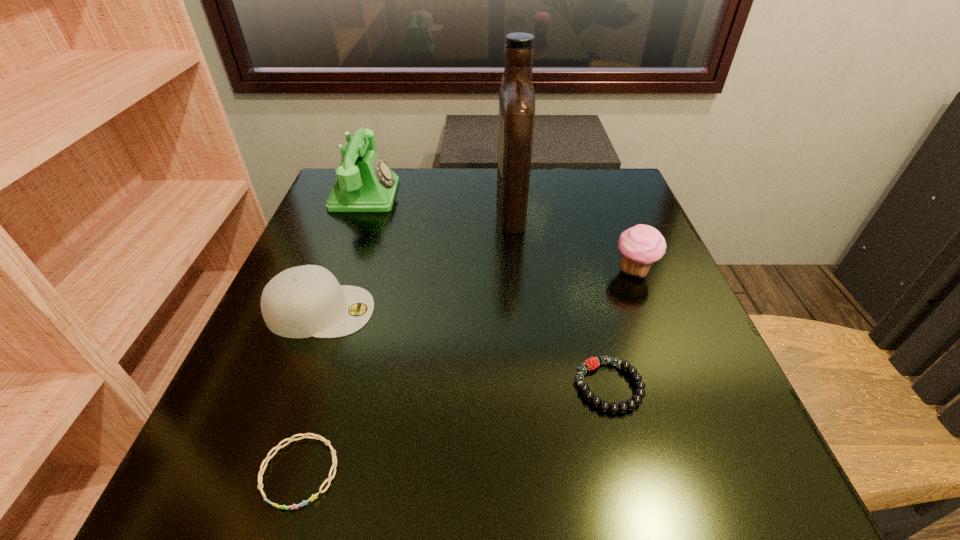
Find the location of a particular element. free area in between the cap and the fifth farthest object is located at coordinates (465, 348).

Where is `vacant area that lies between the third nearest object and the liquor`? The image size is (960, 540). vacant area that lies between the third nearest object and the liquor is located at coordinates coord(416,258).

Identify the location of object that ranks as the fourth closest to the second object from right to left. This screenshot has width=960, height=540. (516, 97).

Find the location of a particular element. The height and width of the screenshot is (540, 960). object that ranks as the fourth closest to the second object from right to left is located at coordinates (516, 97).

In order to click on free space that satisfies the following two spatial constraints: 1. on the front-facing side of the fifth farthest object; 2. on the right side of the third nearest object in this screenshot , I will do `click(293, 386)`.

I want to click on vacant region that satisfies the following two spatial constraints: 1. on the dial of the telephone; 2. on the back side of the right bracelet, so click(296, 386).

Image resolution: width=960 pixels, height=540 pixels. I want to click on vacant space that satisfies the following two spatial constraints: 1. on the back side of the fourth nearest object; 2. on the dial of the telephone, so click(x=604, y=194).

Locate an element on the screen. free spot that satisfies the following two spatial constraints: 1. on the front-facing side of the fourth tallest object; 2. on the left side of the second object from right to left is located at coordinates (293, 386).

Find the location of a particular element. This screenshot has height=540, width=960. vacant space that satisfies the following two spatial constraints: 1. on the front-facing side of the third nearest object; 2. on the back side of the right bracelet is located at coordinates (293, 386).